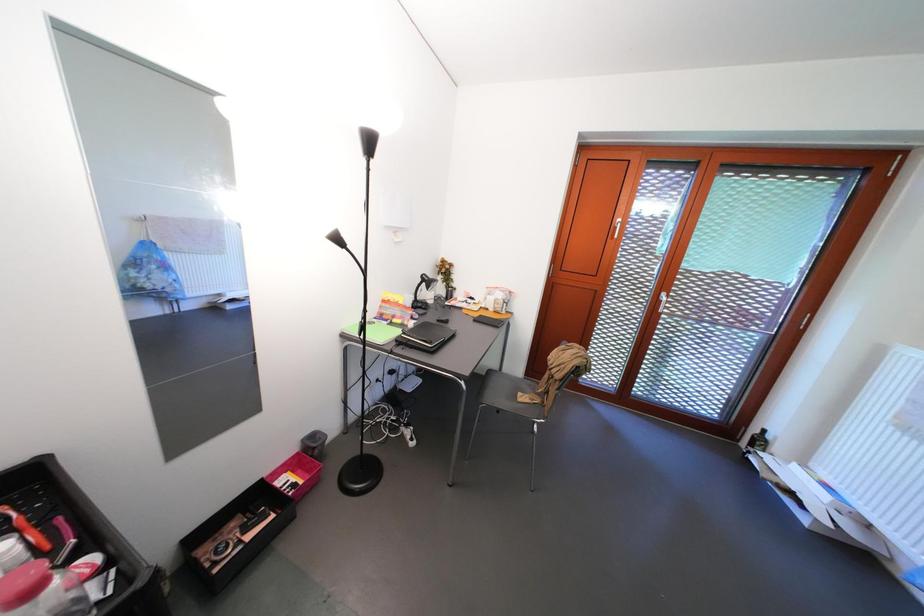
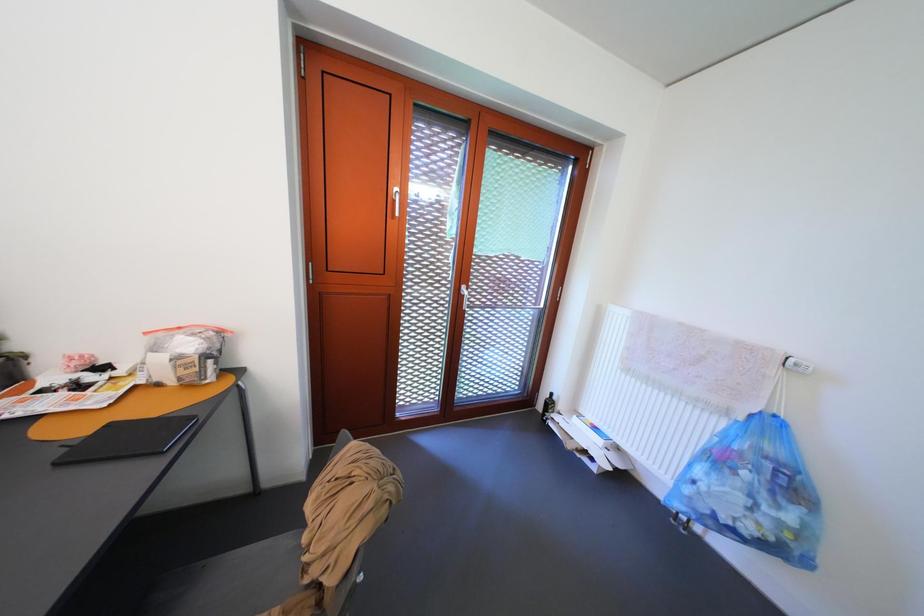
Question: The first image is from the beginning of the video and the second image is from the end. How did the camera likely rotate when shooting the video?

Choices:
 (A) Left
 (B) Right
 (C) Up
 (D) Down

Answer: (B)